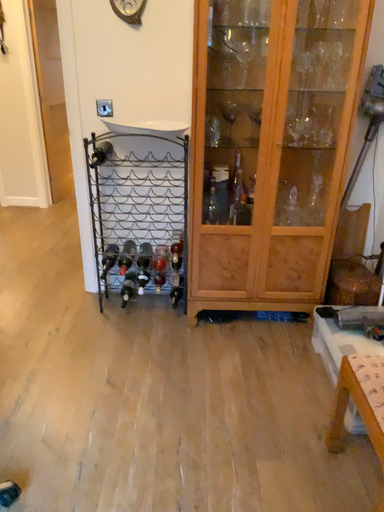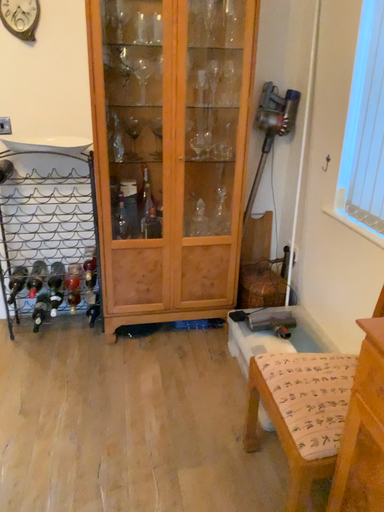
Question: How did the camera likely rotate when shooting the video?

Choices:
 (A) rotated right
 (B) rotated left

Answer: (A)